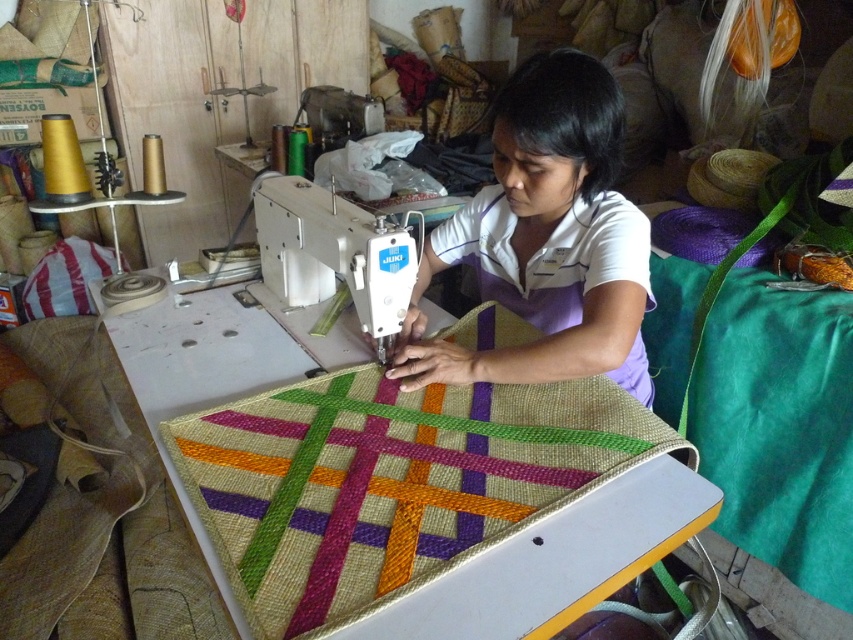
Question: Which of the following is the farthest from the observer?

Choices:
 (A) (602, 109)
 (B) (460, 433)

Answer: (A)

Question: Which point is farther from the camera taking this photo?

Choices:
 (A) (265, 248)
 (B) (511, 236)
 (C) (439, 493)

Answer: (A)

Question: Which point is farther to the camera?

Choices:
 (A) white cotton shirt at center
 (B) white plastic sewing machine at center

Answer: (A)

Question: Is woven fabric quilt at center above white cotton shirt at center?

Choices:
 (A) no
 (B) yes

Answer: (A)

Question: Considering the relative positions of white cotton shirt at center and white plastic sewing machine at center in the image provided, where is white cotton shirt at center located with respect to white plastic sewing machine at center?

Choices:
 (A) right
 (B) left

Answer: (A)

Question: Observing the image, what is the correct spatial positioning of white cotton shirt at center in reference to white plastic sewing machine at center?

Choices:
 (A) right
 (B) left

Answer: (A)